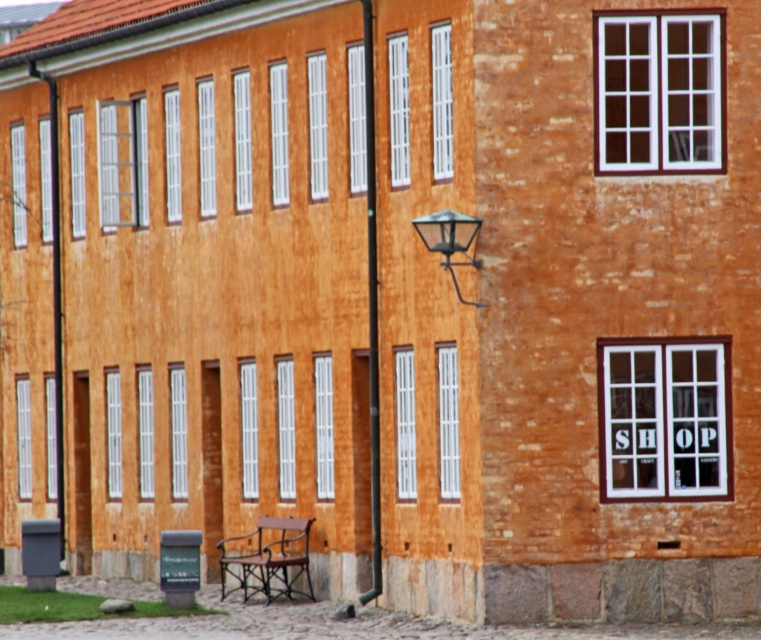
You are a pedestrian sitting on the wooden park bench at lower center and want to reach the metallic black lamp post at left to adjust its light. Can you easily step down from the bench to the ground near the lamp post?

The wooden park bench at lower center is located above the metallic black lamp post at left, so stepping down from the bench to the ground near the lamp post is possible, but the vertical distance might require careful movement due to the elevation difference.

You are a maintenance worker needing to inspect both the wooden park bench at lower center and the metallic black lamp post at left. Given that your inspection equipment has a maximum reach of 10 meters, can you inspect both objects without moving your equipment? Please explain.

The distance between the wooden park bench at lower center and the metallic black lamp post at left is 8.87 meters. Since the equipment can reach up to 10 meters, you can inspect both objects without moving the equipment as the distance is within the maximum reach.

You are standing in front of the building and want to reach both the metallic black lamp post at left and the black glass lamp at center. Which lamp will you touch first as you move toward the building?

The metallic black lamp post at left is closer to you than the black glass lamp at center, so you will touch it first.